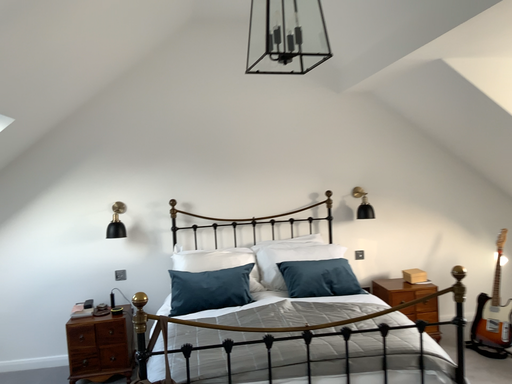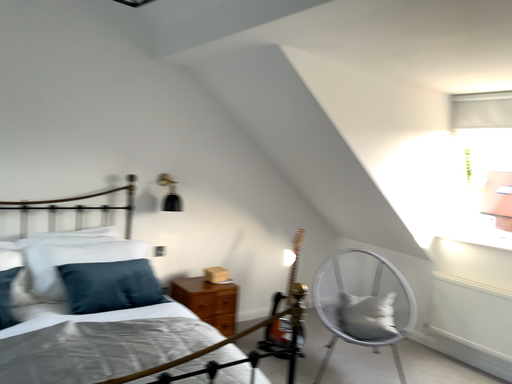
Question: Which way did the camera rotate in the video?

Choices:
 (A) rotated left
 (B) rotated right

Answer: (B)